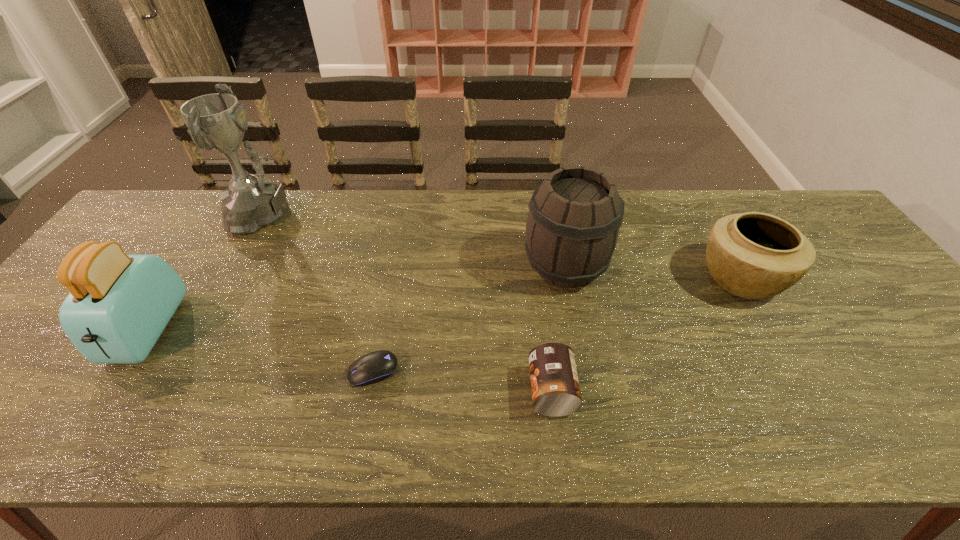
I want to click on the tallest object, so (x=217, y=122).

Image resolution: width=960 pixels, height=540 pixels. I want to click on wine bucket, so click(x=575, y=215).

The width and height of the screenshot is (960, 540). I want to click on toaster, so click(x=118, y=306).

Identify the location of the rightmost object. Image resolution: width=960 pixels, height=540 pixels. (753, 255).

Identify the location of the fourth tallest object. Image resolution: width=960 pixels, height=540 pixels. (753, 255).

Identify the location of can. Image resolution: width=960 pixels, height=540 pixels. click(x=555, y=387).

Identify the location of computer mouse. (376, 366).

Locate an element on the screen. This screenshot has height=540, width=960. the shortest object is located at coordinates pos(376,366).

The height and width of the screenshot is (540, 960). In order to click on free space located on the side with emblem of the tallest object in this screenshot , I will do `click(362, 215)`.

Where is `vacant space located on the back of the wine bucket`? The width and height of the screenshot is (960, 540). vacant space located on the back of the wine bucket is located at coordinates (551, 195).